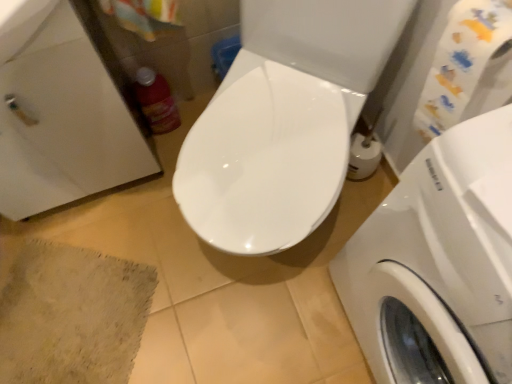
This screenshot has height=384, width=512. In order to click on free space in front of matte plastic bottle at left in this screenshot , I will do `click(159, 162)`.